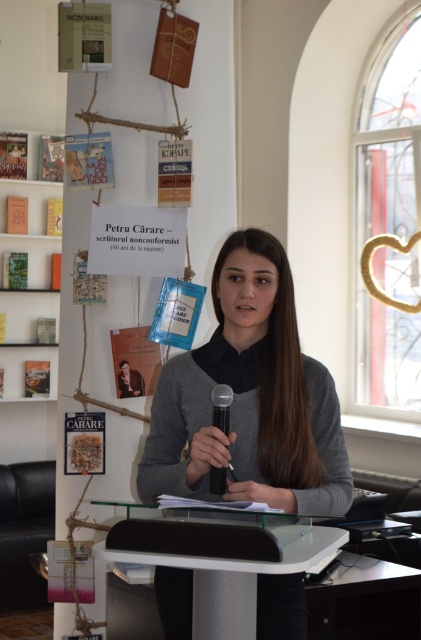
Question: Is white glossy table at center positioned in front of black plastic microphone at center?

Choices:
 (A) yes
 (B) no

Answer: (A)

Question: Is gray matte sweater at center bigger than black plastic microphone at center?

Choices:
 (A) no
 (B) yes

Answer: (B)

Question: Which object is the farthest from the black plastic microphone at center?

Choices:
 (A) white wooden bookshelf at left
 (B) gray matte sweater at center
 (C) white glossy table at center

Answer: (A)

Question: Among these points, which one is farthest from the camera?

Choices:
 (A) (8, 328)
 (B) (324, 371)

Answer: (A)

Question: Can you confirm if white glossy table at center is positioned to the left of black plastic microphone at center?

Choices:
 (A) no
 (B) yes

Answer: (B)

Question: Estimate the real-world distances between objects in this image. Which object is closer to the white glossy table at center?

Choices:
 (A) gray matte sweater at center
 (B) white wooden bookshelf at left
 (C) black plastic microphone at center

Answer: (C)